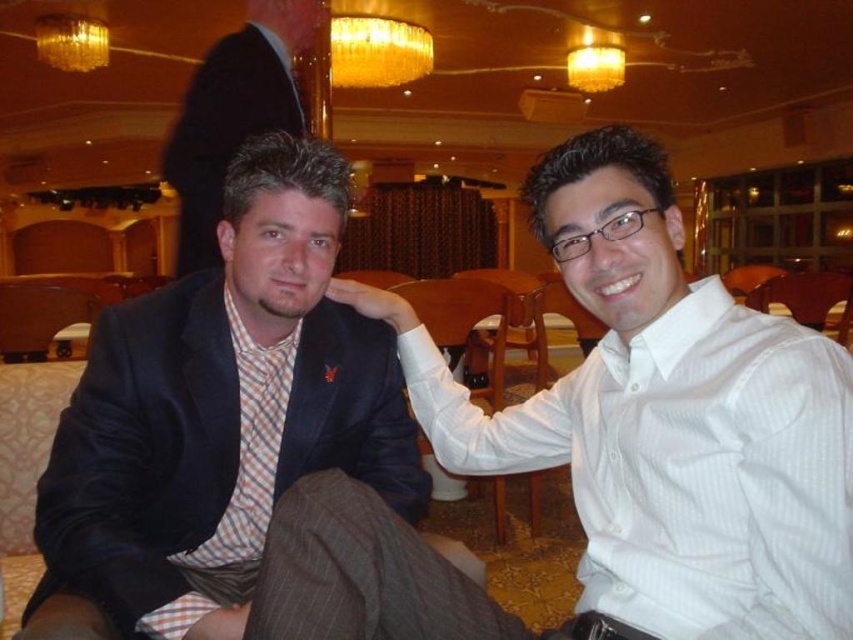
Question: Which point appears closest to the camera in this image?

Choices:
 (A) (84, 35)
 (B) (664, 525)
 (C) (223, 177)

Answer: (B)

Question: Is matte black suit at left further to camera compared to gold metallic chandelier at upper center?

Choices:
 (A) no
 (B) yes

Answer: (A)

Question: Which object appears farthest from the camera in this image?

Choices:
 (A) checkered fabric shirt at center
 (B) matte black suit at left
 (C) gold metallic chandelier at upper center
 (D) gold glass chandelier at upper center

Answer: (D)

Question: Which point is closer to the camera?

Choices:
 (A) (368, 51)
 (B) (613, 371)
 (C) (173, 577)

Answer: (C)

Question: Does checkered fabric shirt at center lie in front of matte black suit at center?

Choices:
 (A) no
 (B) yes

Answer: (B)

Question: Does matte black suit at center appear on the left side of gold metallic chandelier at upper center?

Choices:
 (A) no
 (B) yes

Answer: (B)